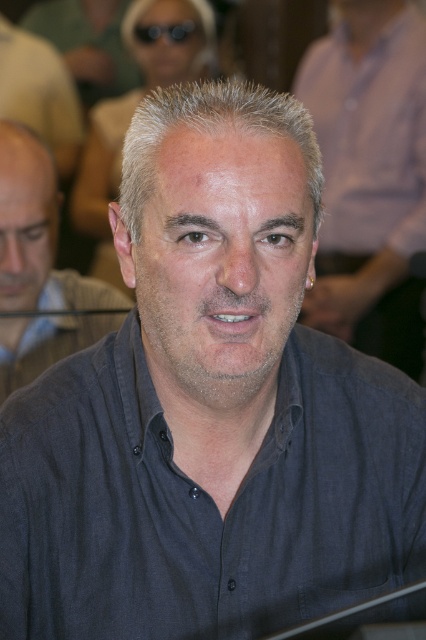
Between gray matte shirt at center and matte gray shirt at left, which one appears on the right side from the viewer's perspective?

gray matte shirt at center

Is gray matte shirt at center positioned behind matte gray shirt at left?

No, gray matte shirt at center is in front of matte gray shirt at left.

Find the location of a particular element. gray matte shirt at center is located at coordinates (370, 176).

You are a GUI agent. You are given a task and a screenshot of the screen. Output one action in this format:
    pyautogui.click(x=<x>, y=<y>)
    Task: Click on the gray matte shirt at center
    Image resolution: width=426 pixels, height=640 pixels.
    Given the screenshot: What is the action you would take?
    pyautogui.click(x=370, y=176)

Which is below, dark gray shirt at center or matte gray shirt at left?

dark gray shirt at center

Is dark gray shirt at center below matte gray shirt at left?

Yes, dark gray shirt at center is below matte gray shirt at left.

Which is behind, point (124, 300) or point (8, 112)?

Point (8, 112)

Locate an element on the screen. dark gray shirt at center is located at coordinates (37, 232).

Is dark gray shirt at center smaller than black plastic goggles at upper center?

No.

Is the position of dark gray shirt at center more distant than that of black plastic goggles at upper center?

That is False.

Which is behind, point (14, 264) or point (190, 35)?

The point (190, 35) is behind.

The height and width of the screenshot is (640, 426). What are the coordinates of `dark gray shirt at center` in the screenshot? It's located at point(37,232).